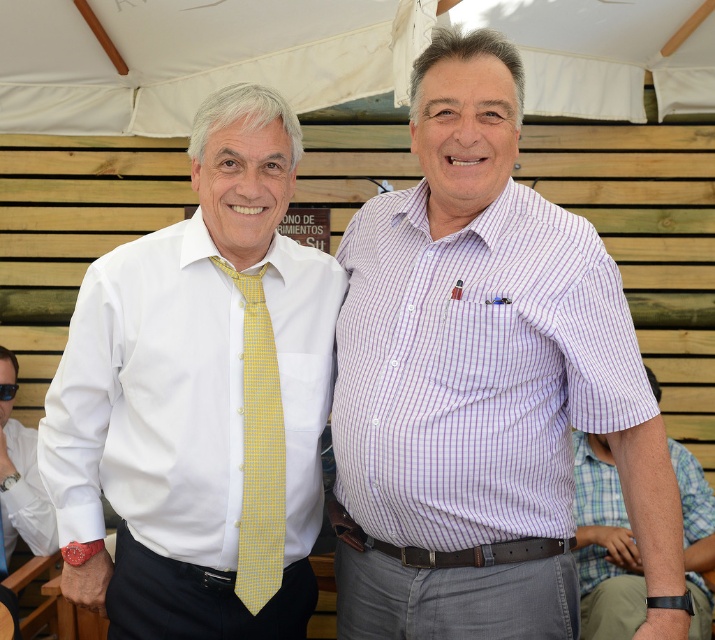
You are a photographer taking a picture of the two men under the white fabric canopy at upper center. To ensure the entire canopy is in frame, where should you position your camera relative to the men?

The white fabric canopy at upper center is located at point (332, 56), so you should position your camera slightly above and to the left of the men to capture the entire canopy in the frame.

You are a photographer trying to capture a clear shot of the white smooth shirt at center and the white shirt at center. Which one is blocking the other?

The white smooth shirt at center is blocking the white shirt at center because it is in front of it.